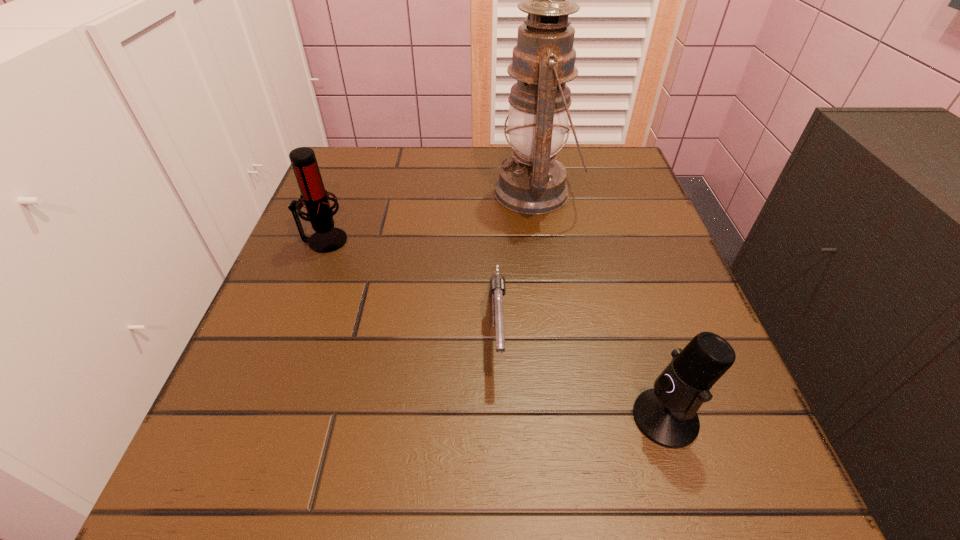
Where is `free area in between the right microphone and the gun`? The width and height of the screenshot is (960, 540). free area in between the right microphone and the gun is located at coordinates (581, 373).

Find the location of `vacant region between the gun and the nearer microphone`. vacant region between the gun and the nearer microphone is located at coordinates (581, 373).

Where is `vacant space that's between the shorter microphone and the gun`? vacant space that's between the shorter microphone and the gun is located at coordinates (581, 373).

Locate an element on the screen. blank region between the third tallest object and the leftmost object is located at coordinates (494, 329).

Image resolution: width=960 pixels, height=540 pixels. I want to click on vacant point located between the leftmost object and the farthest object, so click(x=430, y=217).

Locate an element on the screen. Image resolution: width=960 pixels, height=540 pixels. vacant region between the leftmost object and the shorter microphone is located at coordinates (494, 329).

At what (x,y) coordinates should I click in order to perform the action: click on free space between the farther microphone and the shortest object. Please return your answer as a coordinate pair (x, y). This screenshot has width=960, height=540. Looking at the image, I should click on (411, 284).

Find the location of a particular element. The image size is (960, 540). object that is the closest one to the oil lamp is located at coordinates (497, 290).

Locate which object is the third closest to the oil lamp. Please provide its 2D coordinates. Your answer should be formatted as a tuple, i.e. [(x, y)], where the tuple contains the x and y coordinates of a point satisfying the conditions above.

[(667, 415)]